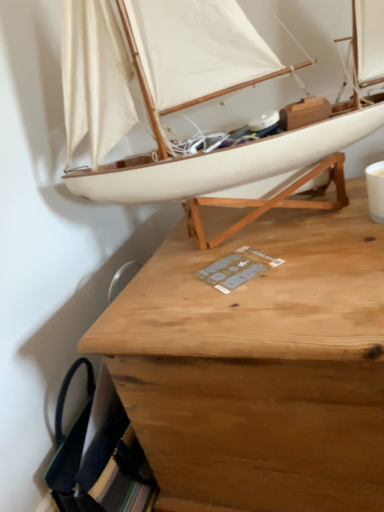
Question: Is wooden desk at center wider than white matte sailboat at upper center?

Choices:
 (A) yes
 (B) no

Answer: (A)

Question: Can you confirm if wooden desk at center is positioned to the left of white matte sailboat at upper center?

Choices:
 (A) no
 (B) yes

Answer: (A)

Question: Is white matte sailboat at upper center a part of wooden desk at center?

Choices:
 (A) yes
 (B) no

Answer: (B)

Question: Is wooden desk at center completely or partially outside of white matte sailboat at upper center?

Choices:
 (A) no
 (B) yes

Answer: (B)

Question: From a real-world perspective, is wooden desk at center beneath white matte sailboat at upper center?

Choices:
 (A) yes
 (B) no

Answer: (A)

Question: Is wooden desk at center aimed at white matte sailboat at upper center?

Choices:
 (A) yes
 (B) no

Answer: (B)

Question: Is white matte sailboat at upper center at the right side of wooden desk at center?

Choices:
 (A) yes
 (B) no

Answer: (B)

Question: Does white matte sailboat at upper center have a lesser width compared to wooden desk at center?

Choices:
 (A) yes
 (B) no

Answer: (A)

Question: Considering the relative sizes of white matte sailboat at upper center and wooden desk at center in the image provided, is white matte sailboat at upper center shorter than wooden desk at center?

Choices:
 (A) no
 (B) yes

Answer: (B)

Question: Can we say white matte sailboat at upper center lies outside wooden desk at center?

Choices:
 (A) yes
 (B) no

Answer: (A)

Question: Is white matte sailboat at upper center aimed at wooden desk at center?

Choices:
 (A) yes
 (B) no

Answer: (B)

Question: From the image's perspective, does white matte sailboat at upper center appear lower than wooden desk at center?

Choices:
 (A) no
 (B) yes

Answer: (A)

Question: Is wooden desk at center inside or outside of white matte sailboat at upper center?

Choices:
 (A) inside
 (B) outside

Answer: (B)